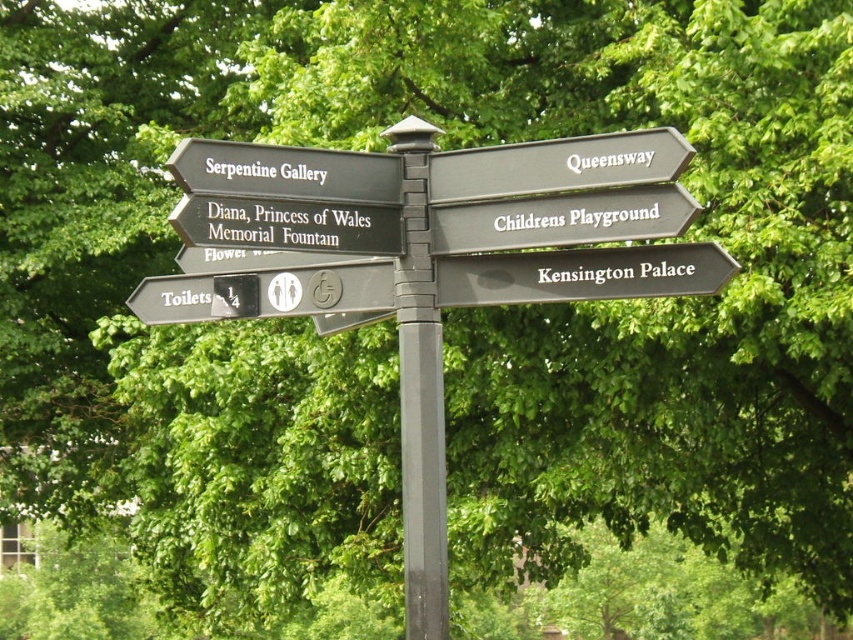
You are standing in a park and see the black matte signpost at lower right and the black matte sign at center. Which one is positioned lower from your viewpoint?

The black matte signpost at lower right is positioned below the black matte sign at center, so it is lower from your viewpoint.

You are standing in a park and see the black matte signpost at lower right and the black matte sign at center. Which one is taller?

The black matte signpost at lower right is taller than the black matte sign at center.

You are standing at the coordinates 0.5, 0.5 in the image. Which direction should you walk to reach the black plastic pole at center?

The black plastic pole at center is located at point (421, 392), so you should walk towards the northeast direction to reach it.